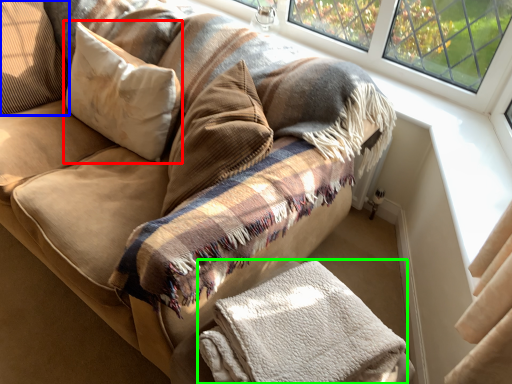
Question: Estimate the real-world distances between objects in this image. Which object is farther from pillow (highlighted by a red box), pillow (highlighted by a blue box) or material (highlighted by a green box)?

Choices:
 (A) pillow
 (B) material

Answer: (B)